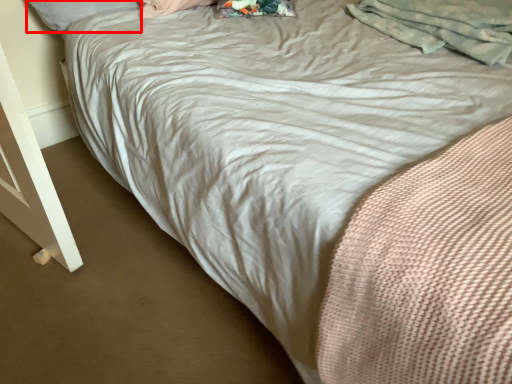
Question: Observing the image, what is the correct spatial positioning of pillow (annotated by the red box) in reference to material?

Choices:
 (A) left
 (B) right

Answer: (A)